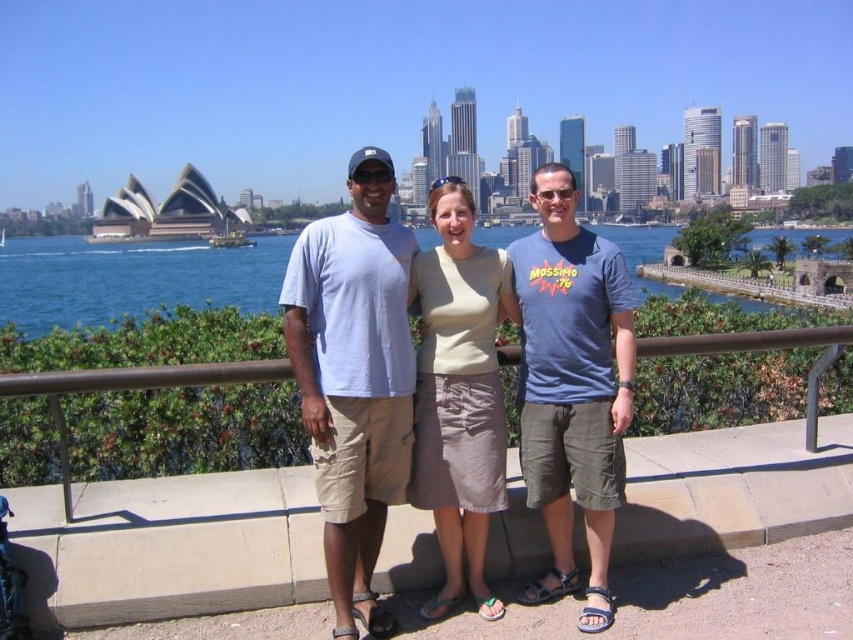
Question: Is light blue cotton shirt at center positioned behind light blue cotton t-shirt at center?

Choices:
 (A) yes
 (B) no

Answer: (A)

Question: Which object appears farthest from the camera in this image?

Choices:
 (A) blue cotton t-shirt at center
 (B) light blue cotton shirt at center
 (C) light blue cotton t-shirt at center
 (D) beige cotton skirt at center

Answer: (A)

Question: Among these points, which one is nearest to the camera?

Choices:
 (A) (471, 365)
 (B) (381, 262)
 (C) (387, 483)

Answer: (C)

Question: Which object is the farthest from the blue cotton t-shirt at center?

Choices:
 (A) beige cotton skirt at center
 (B) blue water at center
 (C) light blue cotton shirt at center
 (D) light blue cotton t-shirt at center

Answer: (B)

Question: Observing the image, what is the correct spatial positioning of light blue cotton shirt at center in reference to beige cotton skirt at center?

Choices:
 (A) below
 (B) above

Answer: (A)

Question: Where is light blue cotton t-shirt at center located in relation to blue water at center in the image?

Choices:
 (A) right
 (B) left

Answer: (B)